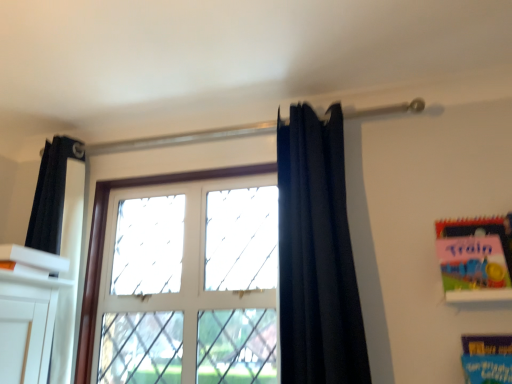
Question: Is matte pink paper at upper right, positioned as the 1th paperback book in top-to-bottom order, at the back of dark blue fabric at center?

Choices:
 (A) no
 (B) yes

Answer: (A)

Question: From the image's perspective, does dark blue fabric at center appear lower than matte pink paper at upper right, positioned as the 1th paperback book in top-to-bottom order?

Choices:
 (A) no
 (B) yes

Answer: (A)

Question: Is dark blue fabric at center smaller than matte pink paper at upper right, the 2th paperback book when ordered from bottom to top?

Choices:
 (A) yes
 (B) no

Answer: (B)

Question: From a real-world perspective, is dark blue fabric at center located higher than matte pink paper at upper right, the 2th paperback book when ordered from bottom to top?

Choices:
 (A) no
 (B) yes

Answer: (B)

Question: Is matte pink paper at upper right, positioned as the 1th paperback book in top-to-bottom order, completely or partially inside dark blue fabric at center?

Choices:
 (A) yes
 (B) no

Answer: (B)

Question: Does point (506, 345) appear closer or farther from the camera than point (506, 238)?

Choices:
 (A) closer
 (B) farther

Answer: (A)

Question: From the image's perspective, is blue cardboard book at lower right, the second paperback book in the top-to-bottom sequence, located above or below matte pink paper at upper right, positioned as the 1th paperback book in top-to-bottom order?

Choices:
 (A) above
 (B) below

Answer: (B)

Question: From their relative heights in the image, would you say blue cardboard book at lower right, the second paperback book in the top-to-bottom sequence, is taller or shorter than matte pink paper at upper right, positioned as the 1th paperback book in top-to-bottom order?

Choices:
 (A) tall
 (B) short

Answer: (B)

Question: Based on their positions, is blue cardboard book at lower right, the second paperback book in the top-to-bottom sequence, located to the left or right of matte pink paper at upper right, positioned as the 1th paperback book in top-to-bottom order?

Choices:
 (A) right
 (B) left

Answer: (B)

Question: Is point (89, 292) positioned closer to the camera than point (481, 370)?

Choices:
 (A) closer
 (B) farther

Answer: (B)

Question: From a real-world perspective, is white glass window at center positioned above or below blue cardboard book at lower right, marked as the first paperback book in a bottom-to-top arrangement?

Choices:
 (A) below
 (B) above

Answer: (B)

Question: Is white glass window at center taller or shorter than blue cardboard book at lower right, marked as the first paperback book in a bottom-to-top arrangement?

Choices:
 (A) short
 (B) tall

Answer: (B)

Question: In the image, is white glass window at center on the left side or the right side of blue cardboard book at lower right, the second paperback book in the top-to-bottom sequence?

Choices:
 (A) right
 (B) left

Answer: (B)

Question: From a real-world perspective, is matte pink paper at upper right, the 2th paperback book when ordered from bottom to top, physically located above or below white glass window at center?

Choices:
 (A) above
 (B) below

Answer: (A)

Question: Is matte pink paper at upper right, positioned as the 1th paperback book in top-to-bottom order, taller or shorter than white glass window at center?

Choices:
 (A) tall
 (B) short

Answer: (B)